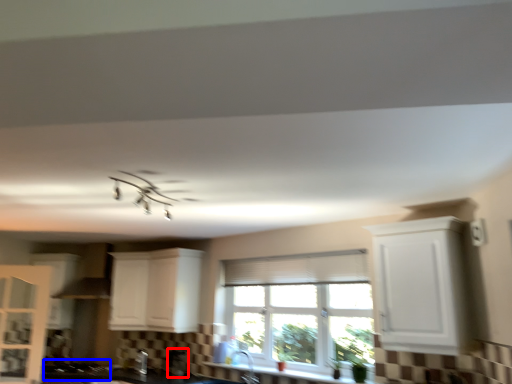
Question: Which of the following is the closest to the observer, appliance (highlighted by a red box) or gas stove (highlighted by a blue box)?

Choices:
 (A) appliance
 (B) gas stove

Answer: (A)